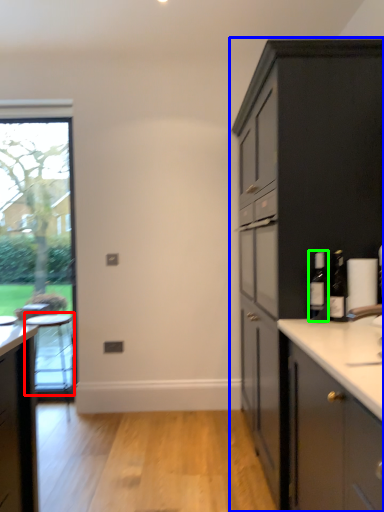
Question: Estimate the real-world distances between objects in this image. Which object is farther from table (highlighted by a red box), cabinetry (highlighted by a blue box) or bottle (highlighted by a green box)?

Choices:
 (A) cabinetry
 (B) bottle

Answer: (B)